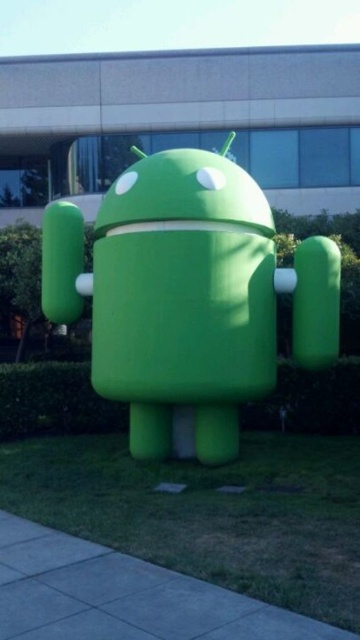
Between green matte robot at center and gray concrete pavement at lower left, which one is positioned lower?

Positioned lower is gray concrete pavement at lower left.

Who is taller, green matte robot at center or gray concrete pavement at lower left?

With more height is green matte robot at center.

Where is `green matte robot at center`? green matte robot at center is located at coordinates (186, 296).

Identify the location of green matte robot at center. (186, 296).